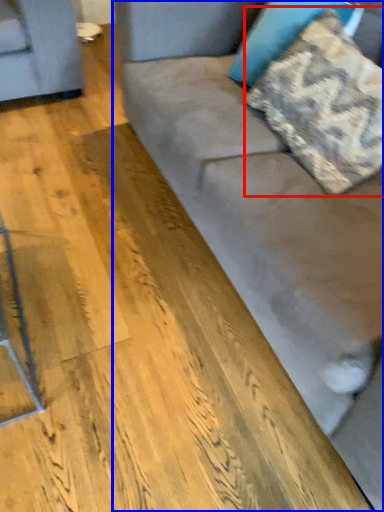
Question: Which object appears farthest to the camera in this image, pillow (highlighted by a red box) or studio couch (highlighted by a blue box)?

Choices:
 (A) pillow
 (B) studio couch

Answer: (A)